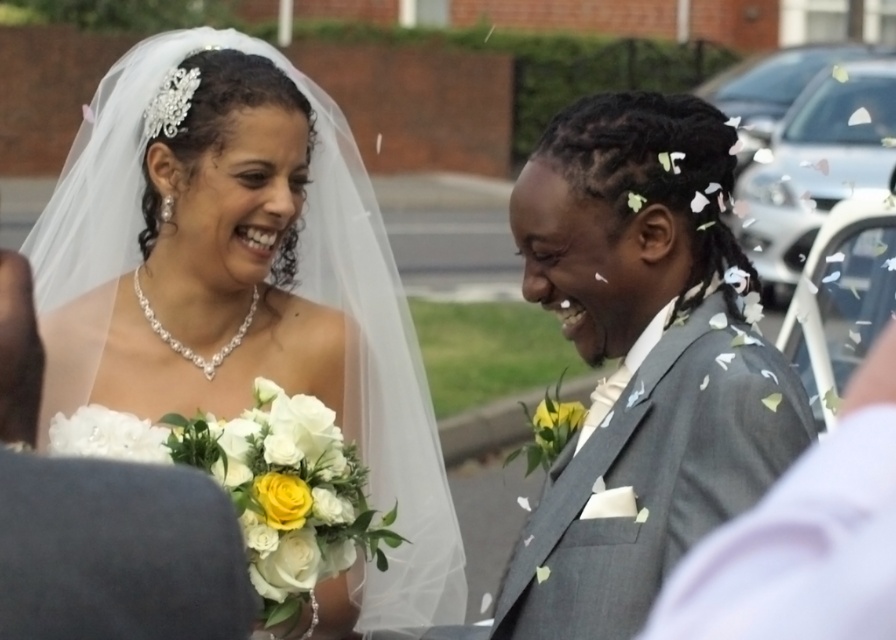
Question: From the image, what is the correct spatial relationship of white satin veil at upper left in relation to gray textured suit at right?

Choices:
 (A) below
 (B) above

Answer: (A)

Question: Among these objects, which one is farthest from the camera?

Choices:
 (A) gray textured suit at right
 (B) white satin veil at upper left

Answer: (B)

Question: Among these objects, which one is nearest to the camera?

Choices:
 (A) gray textured suit at right
 (B) white satin veil at upper left

Answer: (A)

Question: Is white satin veil at upper left positioned at the back of gray textured suit at right?

Choices:
 (A) yes
 (B) no

Answer: (A)

Question: Is white satin veil at upper left closer to camera compared to gray textured suit at right?

Choices:
 (A) yes
 (B) no

Answer: (B)